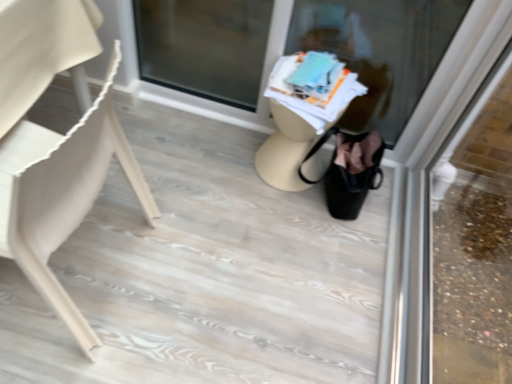
I want to click on free point to the left of beige matte table at center, so point(224,156).